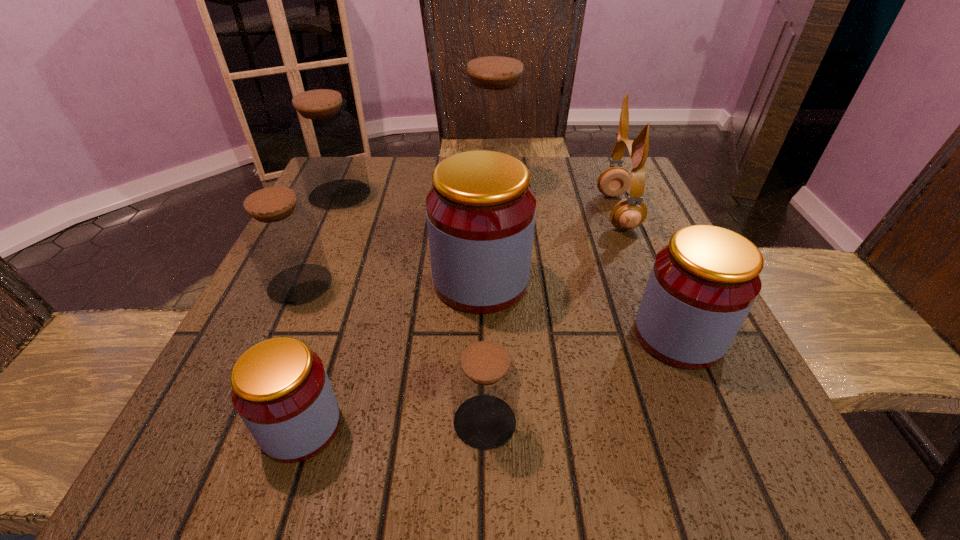
This screenshot has height=540, width=960. What are the coordinates of `object that stands as the fourth closest to the smallest red jar` in the screenshot? It's located at (702, 285).

At what (x,y) coordinates should I click in order to perform the action: click on the fourth closest jar to the third biggest brown jar. Please return your answer as a coordinate pair (x, y). Looking at the image, I should click on (485, 384).

Where is `jar that is the third nearest to the earphone`? jar that is the third nearest to the earphone is located at coordinates pos(702,285).

Locate an element on the screen. This screenshot has width=960, height=540. brown jar identified as the second closest to the rightmost red jar is located at coordinates (495, 113).

Point out which brown jar is positioned as the nearest to the smallest brown jar. Please provide its 2D coordinates. Your answer should be formatted as a tuple, i.e. [(x, y)], where the tuple contains the x and y coordinates of a point satisfying the conditions above.

[(282, 237)]

At what (x,y) coordinates should I click in order to perform the action: click on red jar that stands as the closest to the smallest red jar. Please return your answer as a coordinate pair (x, y). The width and height of the screenshot is (960, 540). Looking at the image, I should click on (480, 213).

Select which red jar is the second closest to the smallest red jar. Please provide its 2D coordinates. Your answer should be formatted as a tuple, i.e. [(x, y)], where the tuple contains the x and y coordinates of a point satisfying the conditions above.

[(702, 285)]

The width and height of the screenshot is (960, 540). Identify the location of free spot that satisfies the following two spatial constraints: 1. on the back side of the nearest red jar; 2. on the right side of the biggest brown jar. (381, 181).

Locate an element on the screen. Image resolution: width=960 pixels, height=540 pixels. free spot that satisfies the following two spatial constraints: 1. on the back side of the nearest red jar; 2. on the left side of the nearest brown jar is located at coordinates (302, 422).

Image resolution: width=960 pixels, height=540 pixels. Find the location of `free space that satisfies the following two spatial constraints: 1. on the front side of the smallest brown jar; 2. on the right side of the third smallest brown jar`. free space that satisfies the following two spatial constraints: 1. on the front side of the smallest brown jar; 2. on the right side of the third smallest brown jar is located at coordinates [239, 422].